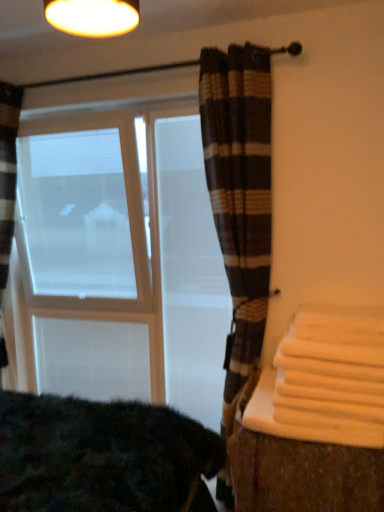
Question: Is white fabric at right oriented towards dark textured blanket at lower left?

Choices:
 (A) yes
 (B) no

Answer: (B)

Question: Does white fabric at right have a lesser width compared to dark textured blanket at lower left?

Choices:
 (A) yes
 (B) no

Answer: (A)

Question: Is white fabric at right wider than dark textured blanket at lower left?

Choices:
 (A) no
 (B) yes

Answer: (A)

Question: From a real-world perspective, is white fabric at right over dark textured blanket at lower left?

Choices:
 (A) no
 (B) yes

Answer: (A)

Question: Is white fabric at right positioned with its back to dark textured blanket at lower left?

Choices:
 (A) yes
 (B) no

Answer: (B)

Question: Relative to white matte window screen at left, is orange cotton bath towel at right in front or behind?

Choices:
 (A) behind
 (B) front

Answer: (B)

Question: Is orange cotton bath towel at right to the left or to the right of white matte window screen at left in the image?

Choices:
 (A) left
 (B) right

Answer: (B)

Question: From a real-world perspective, relative to white matte window screen at left, is orange cotton bath towel at right vertically above or below?

Choices:
 (A) below
 (B) above

Answer: (A)

Question: Looking at the image, does orange cotton bath towel at right seem bigger or smaller compared to white matte window screen at left?

Choices:
 (A) big
 (B) small

Answer: (B)

Question: Is point (29, 251) positioned closer to the camera than point (238, 367)?

Choices:
 (A) farther
 (B) closer

Answer: (A)

Question: Is white matte window screen at left taller or shorter than plaid fabric curtain at center?

Choices:
 (A) short
 (B) tall

Answer: (A)

Question: Choose the correct answer: Is white matte window screen at left inside plaid fabric curtain at center or outside it?

Choices:
 (A) inside
 (B) outside

Answer: (B)

Question: Considering the relative positions of white matte window screen at left and plaid fabric curtain at center in the image provided, is white matte window screen at left to the left or to the right of plaid fabric curtain at center?

Choices:
 (A) left
 (B) right

Answer: (A)

Question: Is point (82, 445) positioned closer to the camera than point (203, 211)?

Choices:
 (A) farther
 (B) closer

Answer: (B)

Question: From a real-world perspective, is dark textured blanket at lower left positioned above or below white matte screen door at center?

Choices:
 (A) below
 (B) above

Answer: (A)